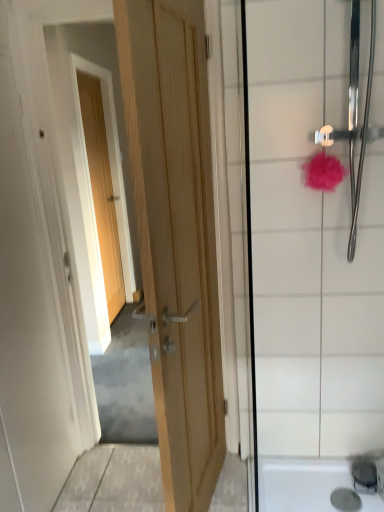
Question: Is point 185,314 positioned closer to the camera than point 120,264?

Choices:
 (A) farther
 (B) closer

Answer: (B)

Question: From the image's perspective, is wooden door at center, which ranks as the 2th door in left-to-right order, positioned above or below light wood door at upper left, which is counted as the second door, starting from the right?

Choices:
 (A) above
 (B) below

Answer: (B)

Question: Considering the real-world distances, which object is farthest from the satin nickel faucet at lower right?

Choices:
 (A) pink fluffy sponge at upper right
 (B) wooden door at center, arranged as the 1th door when viewed from the right
 (C) light wood door at upper left, which is counted as the second door, starting from the right
 (D) pink fluffy bath puff at upper right
 (E) white glossy shower door at right

Answer: (C)

Question: Which object is positioned farthest from the pink fluffy sponge at upper right?

Choices:
 (A) wooden door at center, arranged as the 1th door when viewed from the right
 (B) satin nickel faucet at lower right
 (C) pink fluffy bath puff at upper right
 (D) light wood door at upper left, which is counted as the first door, starting from the back
 (E) white glossy shower door at right

Answer: (D)